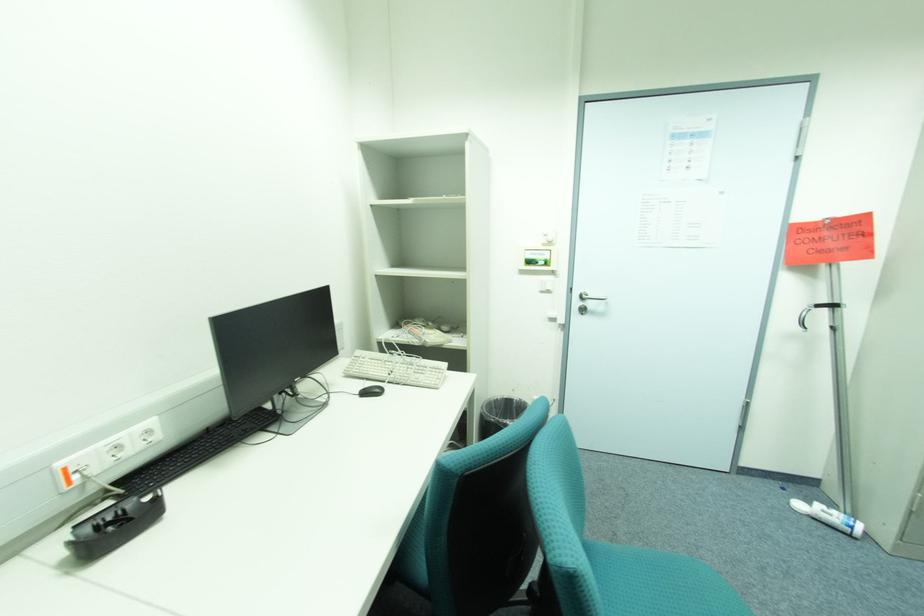
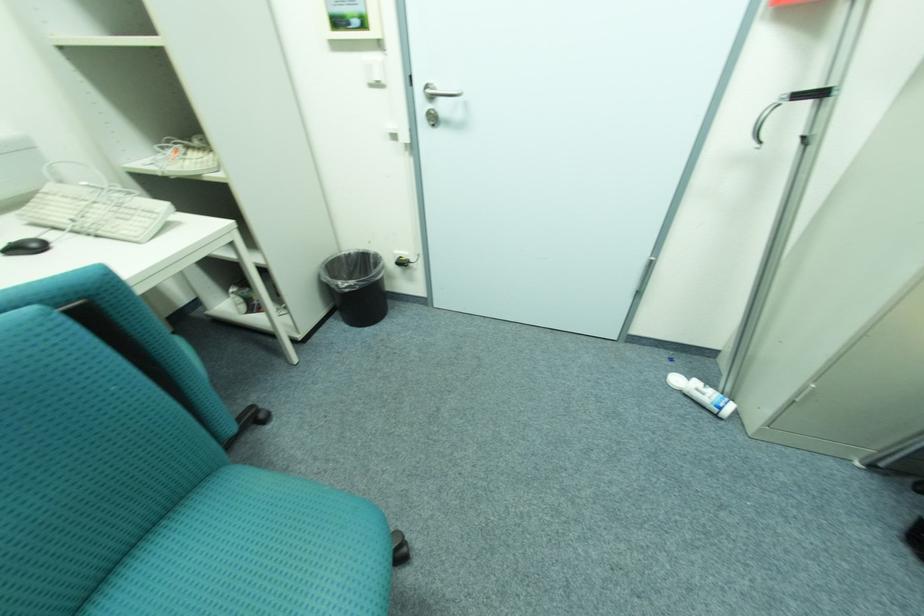
Find the pixel in the second image that matches [504,400] in the first image.

(358, 254)